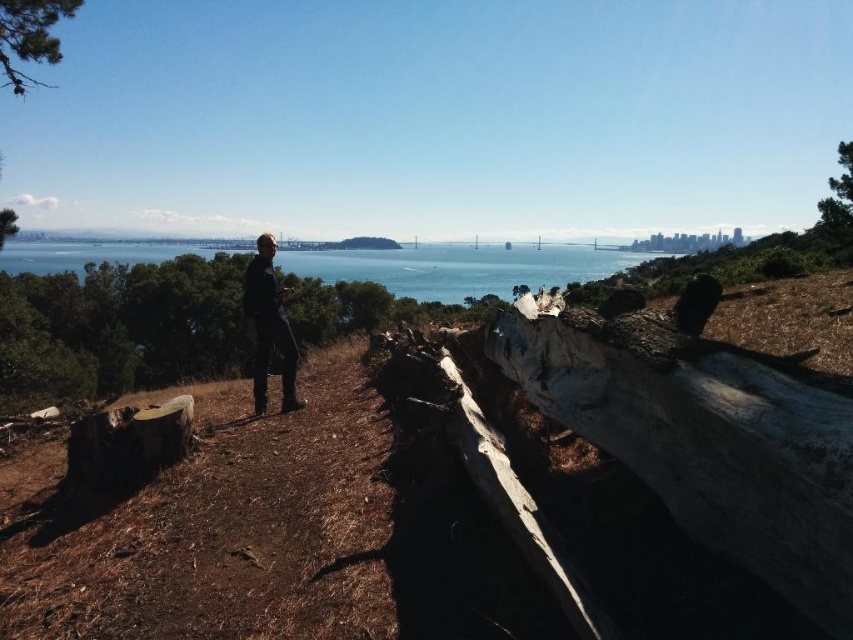
Is blue water at center below green rough bark tree at upper left?

Correct, blue water at center is located below green rough bark tree at upper left.

Looking at this image, between blue water at center and green rough bark tree at upper left, which one is positioned lower?

Positioned lower is blue water at center.

Is point (308, 275) closer to camera compared to point (55, 22)?

That is False.

Where is `blue water at center`? blue water at center is located at coordinates (461, 268).

Measure the distance between dark blue jeans at center and camera.

dark blue jeans at center is 7.35 meters away from camera.

Does point (277, 305) come behind point (838, 161)?

No.

The image size is (853, 640). I want to click on dark blue jeans at center, so click(x=270, y=326).

Who is higher up, green rough bark tree at upper left or green rough bark tree at upper right?

green rough bark tree at upper left is higher up.

In the scene shown: Is green rough bark tree at upper left to the right of green rough bark tree at upper right from the viewer's perspective?

No, green rough bark tree at upper left is not to the right of green rough bark tree at upper right.

Where is `green rough bark tree at upper left`? green rough bark tree at upper left is located at coordinates (30, 36).

The width and height of the screenshot is (853, 640). I want to click on green rough bark tree at upper left, so click(x=30, y=36).